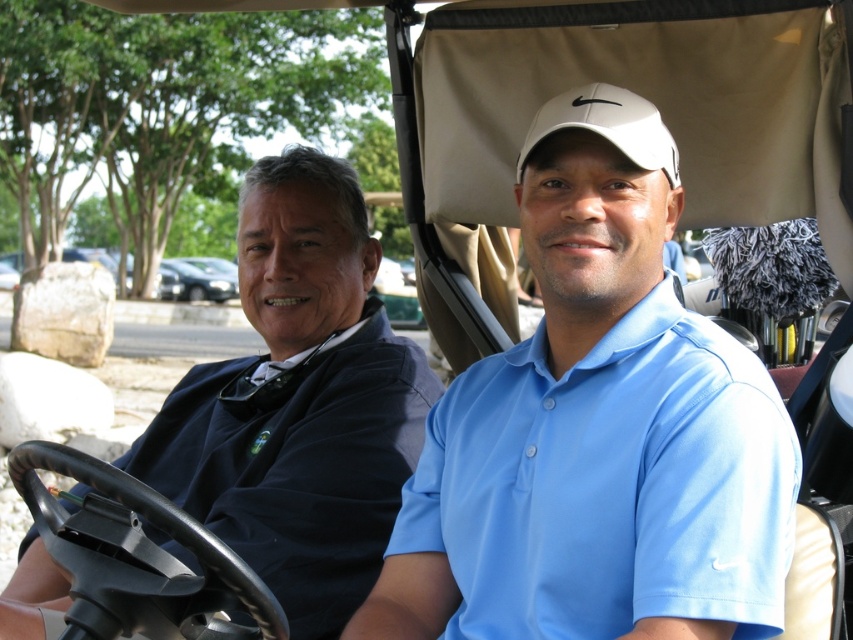
Is point (381, 612) farther from viewer compared to point (355, 202)?

No, (381, 612) is in front of (355, 202).

Which is below, blue matte shirt at center or dark blue shirt at left?

dark blue shirt at left is below.

The image size is (853, 640). What do you see at coordinates (596, 429) in the screenshot?
I see `blue matte shirt at center` at bounding box center [596, 429].

Find the location of a particular element. The image size is (853, 640). blue matte shirt at center is located at coordinates (596, 429).

Is dark blue shirt at left below white matte baseball cap at center?

Correct, dark blue shirt at left is located below white matte baseball cap at center.

Who is taller, dark blue shirt at left or white matte baseball cap at center?

dark blue shirt at left is taller.

Does point (294, 173) come closer to viewer compared to point (556, 112)?

No, it is not.

The image size is (853, 640). Find the location of `dark blue shirt at left`. dark blue shirt at left is located at coordinates (299, 401).

Is blue matte shirt at center thinner than white matte baseball cap at center?

No, blue matte shirt at center is not thinner than white matte baseball cap at center.

Does blue matte shirt at center have a lesser height compared to white matte baseball cap at center?

In fact, blue matte shirt at center may be taller than white matte baseball cap at center.

Does point (485, 461) come in front of point (611, 115)?

No, it is not.

Locate an element on the screen. blue matte shirt at center is located at coordinates pos(596,429).